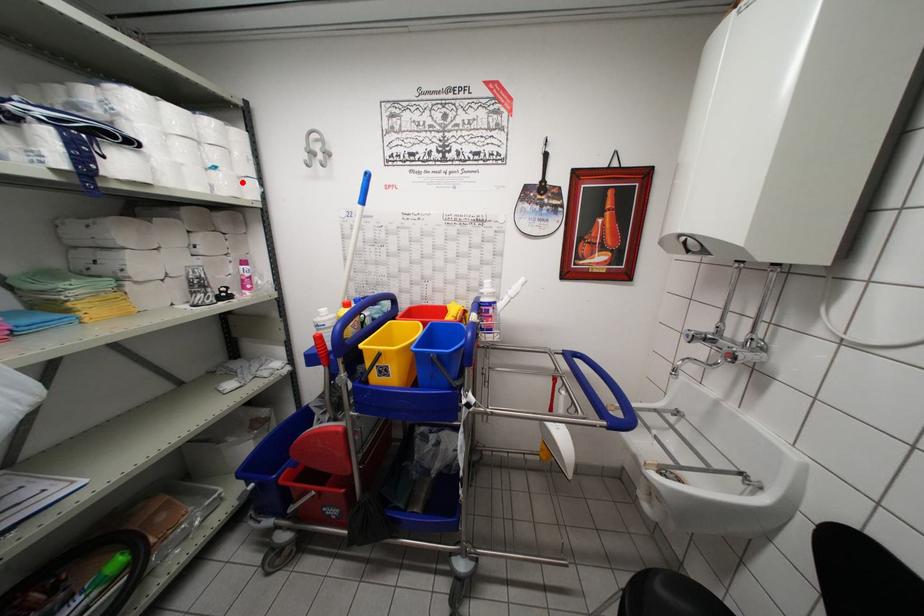
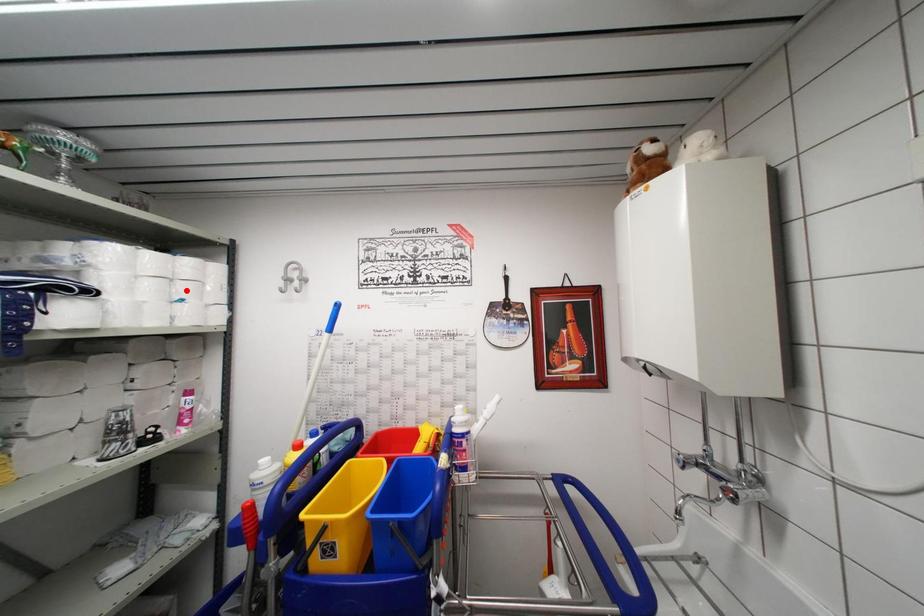
I am providing you with two images of the same scene from different viewpoints. A red point is marked on the first image and another point is marked on the second image. Is the marked point in image1 the same physical position as the marked point in image2?

No